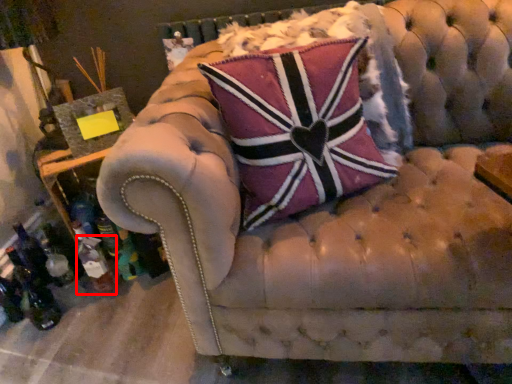
Question: From the image's perspective, considering the relative positions of bottle (annotated by the red box) and pillow in the image provided, where is bottle (annotated by the red box) located with respect to the staircase?

Choices:
 (A) below
 (B) above

Answer: (A)